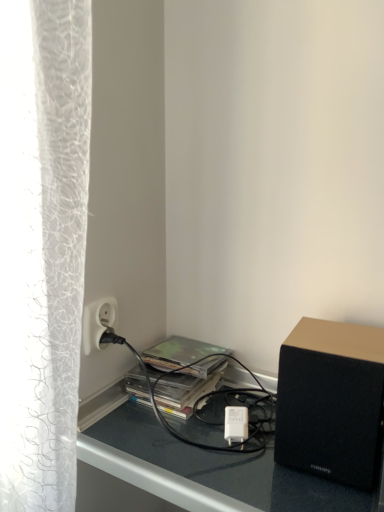
Question: From the image's perspective, relative to camouflage paper at center, is black matte speaker at lower right above or below?

Choices:
 (A) above
 (B) below

Answer: (B)

Question: Is black matte speaker at lower right wider or thinner than camouflage paper at center?

Choices:
 (A) wide
 (B) thin

Answer: (A)

Question: Which of these objects is positioned farthest from the camouflage paper at center?

Choices:
 (A) white plastic power outlet at lower left
 (B) black matte speaker at lower right

Answer: (B)

Question: Based on their relative distances, which object is nearer to the white plastic power outlet at lower left?

Choices:
 (A) black matte speaker at lower right
 (B) camouflage paper at center

Answer: (B)